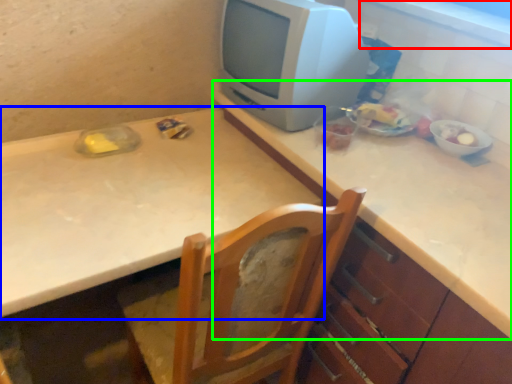
Question: Estimate the real-world distances between objects in this image. Which object is closer to window sill (highlighted by a red box), table (highlighted by a blue box) or counter top (highlighted by a green box)?

Choices:
 (A) table
 (B) counter top

Answer: (B)